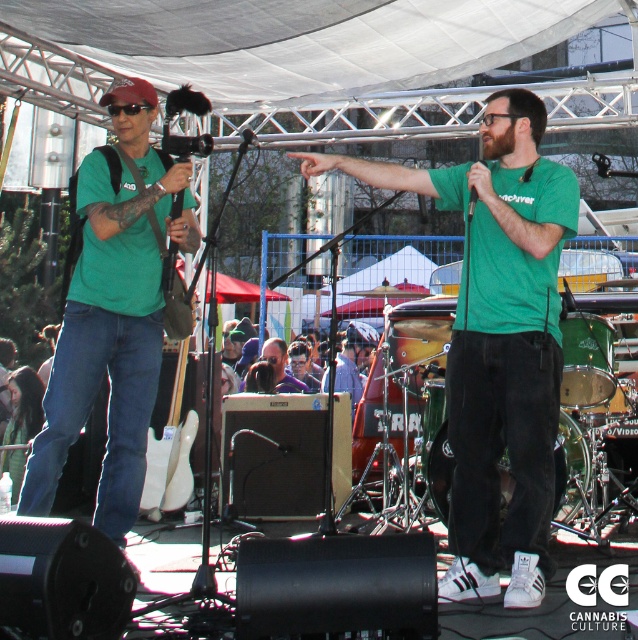
Question: Can you confirm if green matte t-shirt at center is positioned to the right of matte green t-shirt at left?

Choices:
 (A) no
 (B) yes

Answer: (B)

Question: Observing the image, what is the correct spatial positioning of green matte t-shirt at center in reference to matte green t-shirt at left?

Choices:
 (A) below
 (B) above

Answer: (A)

Question: Among these points, which one is farthest from the camera?

Choices:
 (A) (464, 353)
 (B) (128, 262)

Answer: (B)

Question: Which of the following is the farthest from the observer?

Choices:
 (A) (545, 280)
 (B) (128, 424)

Answer: (B)

Question: Among these points, which one is nearest to the camera?

Choices:
 (A) (493, 257)
 (B) (110, 352)

Answer: (A)

Question: Does green matte t-shirt at center have a smaller size compared to matte green t-shirt at left?

Choices:
 (A) no
 (B) yes

Answer: (A)